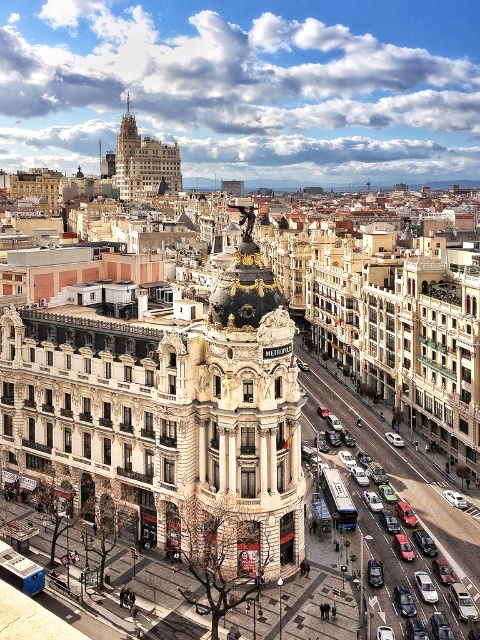
Who is more distant from viewer, (x=151, y=161) or (x=424, y=593)?

Positioned behind is point (x=151, y=161).

Locate an element on the screen. This screenshot has height=640, width=480. gold textured tower at upper center is located at coordinates (144, 163).

Which is more to the right, beige stone tower at center or matte black car at center?

matte black car at center is more to the right.

Which is in front, point (149, 468) or point (451, 554)?

Point (149, 468) is in front.

The width and height of the screenshot is (480, 640). Describe the element at coordinates (231, 422) in the screenshot. I see `beige stone tower at center` at that location.

At what (x,y) coordinates should I click in order to perform the action: click on beige stone tower at center. Please return your answer as a coordinate pair (x, y). The height and width of the screenshot is (640, 480). Looking at the image, I should click on (231, 422).

Is point (311, 419) less distant than point (425, 589)?

No, (311, 419) is behind (425, 589).

Between matte black car at center and silver metallic sedan at center, which one appears on the right side from the viewer's perspective?

A: matte black car at center

Where is `matte black car at center`? matte black car at center is located at coordinates (433, 528).